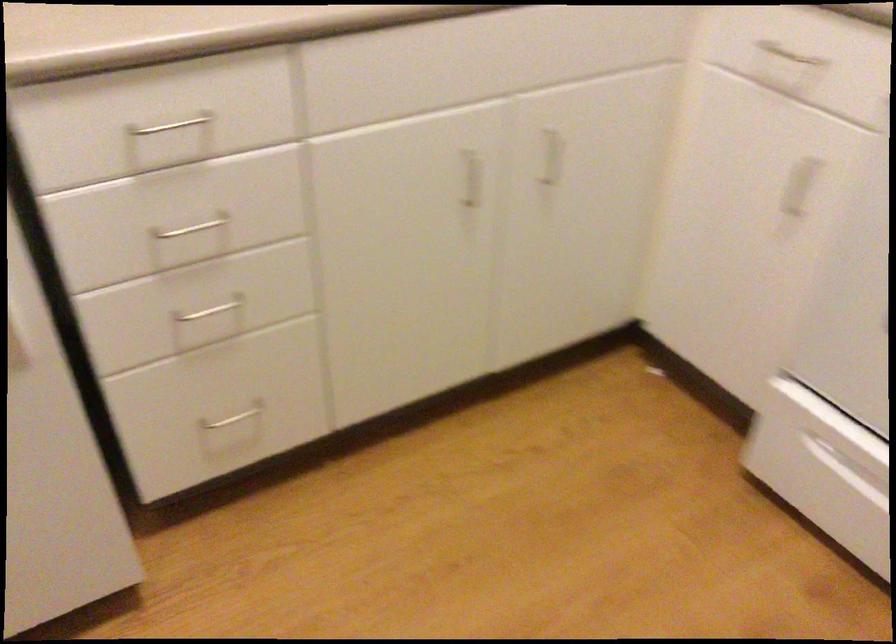
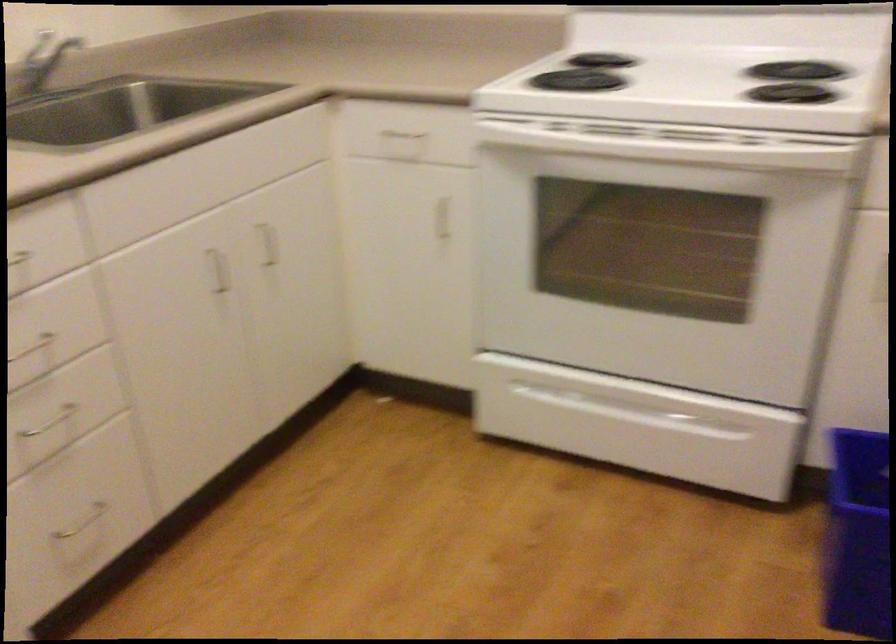
Question: The images are taken continuously from a first-person perspective. In which direction is your viewpoint rotating?

Choices:
 (A) Left
 (B) Right
 (C) Up
 (D) Down

Answer: (B)